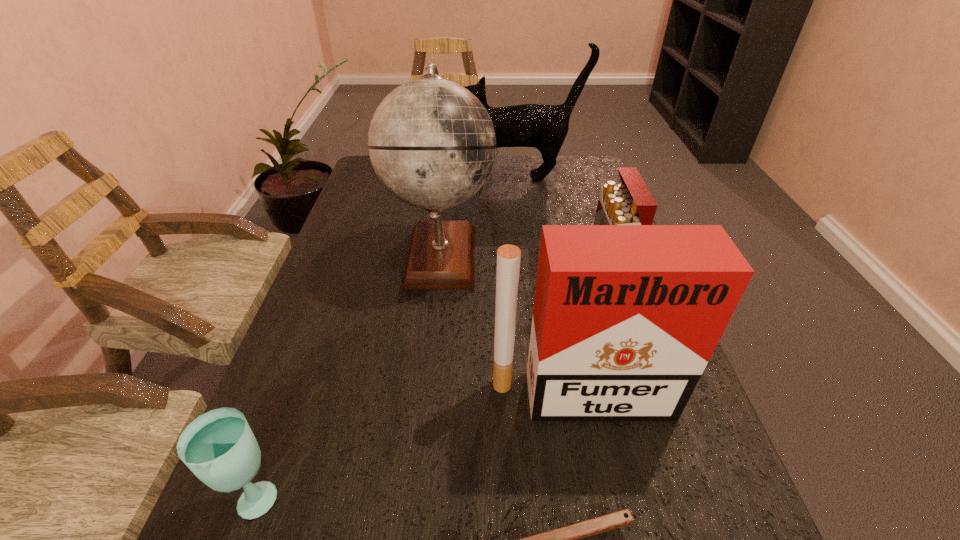
You are a GUI agent. You are given a task and a screenshot of the screen. Output one action in this format:
    pyautogui.click(x=<x>, y=<y>)
    Task: Click on the free space located on the face of the farthest object
    The width and height of the screenshot is (960, 540).
    Given the screenshot: What is the action you would take?
    pyautogui.click(x=361, y=177)

The height and width of the screenshot is (540, 960). I want to click on vacant space situated on the face of the farthest object, so click(396, 177).

Locate an element on the screen. The height and width of the screenshot is (540, 960). vacant point located on the front-facing side of the nearer cigarette case is located at coordinates point(596,473).

Identify the location of vacant point located with the lid open on the shorter cigarette case. The height and width of the screenshot is (540, 960). (550, 277).

I want to click on blank area located with the lid open on the shorter cigarette case, so (448, 277).

The height and width of the screenshot is (540, 960). In order to click on vacant region located 0.250m with the lid open on the shorter cigarette case in this screenshot , I will do `click(487, 277)`.

Locate an element on the screen. This screenshot has width=960, height=540. vacant point located 0.400m on the back of the leftmost object is located at coordinates (330, 294).

This screenshot has width=960, height=540. What are the coordinates of `object situated at the far edge` in the screenshot? It's located at (544, 127).

Locate an element on the screen. The image size is (960, 540). globe at the left edge is located at coordinates (432, 144).

The width and height of the screenshot is (960, 540). I want to click on glass that is at the left edge, so click(x=219, y=447).